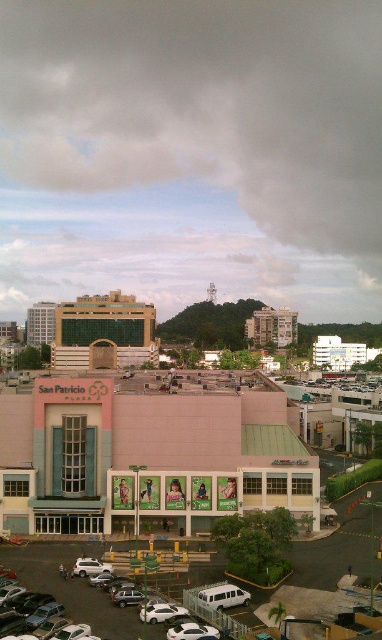
Question: Can you confirm if white textured building at center-right is thinner than white matte building at upper center?

Choices:
 (A) no
 (B) yes

Answer: (B)

Question: Among these objects, which one is nearest to the camera?

Choices:
 (A) pink matte building at center
 (B) white textured building at center-right
 (C) green glass building at upper left

Answer: (A)

Question: Which object is farther from the camera taking this photo?

Choices:
 (A) white textured building at center-right
 (B) white matte building at upper center
 (C) green glass building at center

Answer: (A)

Question: Observing the image, what is the correct spatial positioning of green glass building at center in reference to green glass building at upper left?

Choices:
 (A) left
 (B) right

Answer: (B)

Question: Based on their relative distances, which object is nearer to the white textured building at center-right?

Choices:
 (A) green glass building at upper left
 (B) white matte building at upper center
 (C) green glass building at center
 (D) pink matte building at center

Answer: (B)

Question: Considering the relative positions of green glass building at center and white textured building at center-right in the image provided, where is green glass building at center located with respect to white textured building at center-right?

Choices:
 (A) left
 (B) right

Answer: (A)